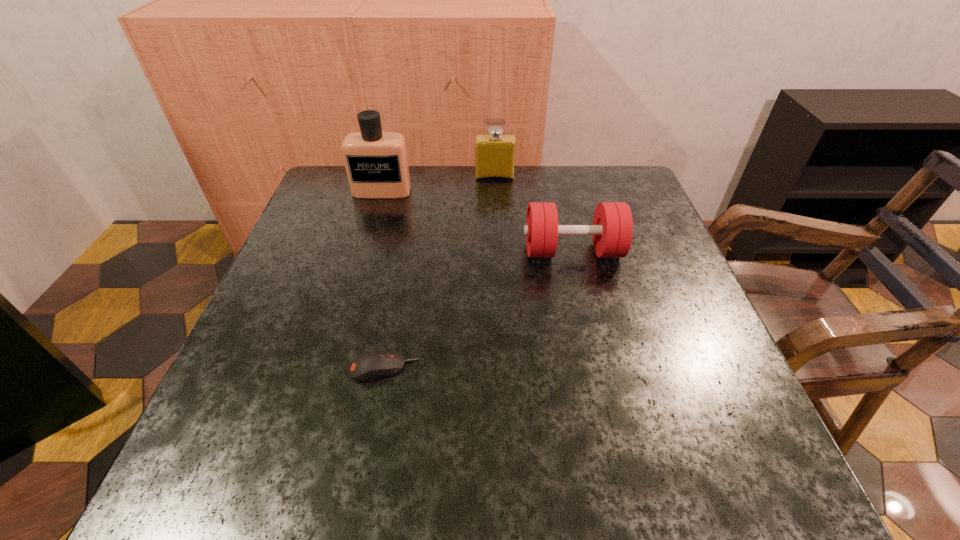
Find the location of `empty space that is in between the second nearest object and the left perfume`. empty space that is in between the second nearest object and the left perfume is located at coordinates (477, 221).

Locate which object is the closest to the third farthest object. Please provide its 2D coordinates. Your answer should be formatted as a tuple, i.e. [(x, y)], where the tuple contains the x and y coordinates of a point satisfying the conditions above.

[(495, 152)]

Select which object appears as the second closest to the taller perfume. Please provide its 2D coordinates. Your answer should be formatted as a tuple, i.e. [(x, y)], where the tuple contains the x and y coordinates of a point satisfying the conditions above.

[(612, 229)]

At what (x,y) coordinates should I click in order to perform the action: click on free space that satisfies the following two spatial constraints: 1. on the front-facing side of the dumbbell; 2. on the left side of the farther perfume. Please return your answer as a coordinate pair (x, y). Looking at the image, I should click on (498, 251).

This screenshot has width=960, height=540. What are the coordinates of `blank area in the image that satisfies the following two spatial constraints: 1. on the front-facing side of the farthest object; 2. on the right side of the second nearest object` in the screenshot? It's located at (498, 251).

Identify the location of vacant space that satisfies the following two spatial constraints: 1. on the front label of the shortest object; 2. on the left side of the taller perfume. (330, 368).

You are a GUI agent. You are given a task and a screenshot of the screen. Output one action in this format:
    pyautogui.click(x=<x>, y=<y>)
    Task: Click on the free space that satisfies the following two spatial constraints: 1. on the front label of the third tallest object; 2. on the left side of the tallest object
    The height and width of the screenshot is (540, 960).
    Given the screenshot: What is the action you would take?
    pyautogui.click(x=365, y=251)

You are a GUI agent. You are given a task and a screenshot of the screen. Output one action in this format:
    pyautogui.click(x=<x>, y=<y>)
    Task: Click on the free location that satisfies the following two spatial constraints: 1. on the front-facing side of the right perfume; 2. on the right side of the second shortest object
    Image resolution: width=960 pixels, height=540 pixels.
    Given the screenshot: What is the action you would take?
    pyautogui.click(x=498, y=251)